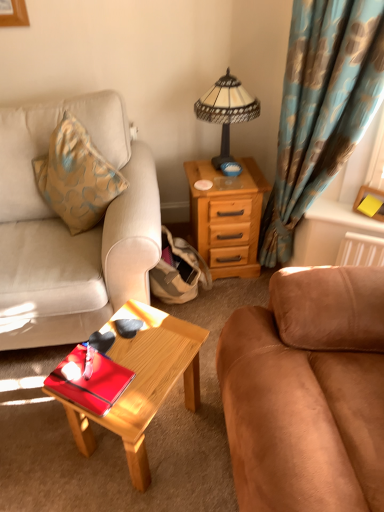
Question: Considering the relative sizes of suede brown couch at right, the 1th studio couch when ordered from right to left, and glossy red tray at center in the image provided, is suede brown couch at right, the 1th studio couch when ordered from right to left, smaller than glossy red tray at center?

Choices:
 (A) no
 (B) yes

Answer: (A)

Question: Are suede brown couch at right, the 1th studio couch when ordered from right to left, and glossy red tray at center beside each other?

Choices:
 (A) no
 (B) yes

Answer: (A)

Question: Does suede brown couch at right, the 1th studio couch when ordered from right to left, have a greater width compared to glossy red tray at center?

Choices:
 (A) yes
 (B) no

Answer: (A)

Question: Can you confirm if suede brown couch at right, which is the 2th studio couch from left to right, is bigger than glossy red tray at center?

Choices:
 (A) yes
 (B) no

Answer: (A)

Question: Does suede brown couch at right, which is the 2th studio couch from left to right, contain glossy red tray at center?

Choices:
 (A) no
 (B) yes

Answer: (A)

Question: Considering the positions of point (109, 391) and point (91, 98), is point (109, 391) closer or farther from the camera than point (91, 98)?

Choices:
 (A) farther
 (B) closer

Answer: (B)

Question: Considering the positions of glossy red tray at center and suede beige couch at left, the 1th studio couch viewed from the left, in the image, is glossy red tray at center bigger or smaller than suede beige couch at left, the 1th studio couch viewed from the left,?

Choices:
 (A) big
 (B) small

Answer: (B)

Question: In the image, is glossy red tray at center positioned in front of or behind suede beige couch at left, the 1th studio couch viewed from the left?

Choices:
 (A) behind
 (B) front

Answer: (B)

Question: Is glossy red tray at center inside the boundaries of suede beige couch at left, the 1th studio couch viewed from the left, or outside?

Choices:
 (A) outside
 (B) inside

Answer: (A)

Question: From the image's perspective, is glossy red tray at center above or below yellow matte picture frame at upper right?

Choices:
 (A) above
 (B) below

Answer: (B)

Question: Considering the relative positions of glossy red tray at center and yellow matte picture frame at upper right in the image provided, is glossy red tray at center to the left or to the right of yellow matte picture frame at upper right?

Choices:
 (A) left
 (B) right

Answer: (A)

Question: From a real-world perspective, relative to yellow matte picture frame at upper right, is glossy red tray at center vertically above or below?

Choices:
 (A) above
 (B) below

Answer: (B)

Question: Which is correct: glossy red tray at center is inside yellow matte picture frame at upper right, or outside of it?

Choices:
 (A) inside
 (B) outside

Answer: (B)

Question: Is blue floral fabric curtain at right spatially inside suede beige couch at left, the 2th studio couch viewed from the right, or outside of it?

Choices:
 (A) outside
 (B) inside

Answer: (A)

Question: Considering the relative positions of blue floral fabric curtain at right and suede beige couch at left, the 1th studio couch viewed from the left, in the image provided, is blue floral fabric curtain at right to the left or to the right of suede beige couch at left, the 1th studio couch viewed from the left,?

Choices:
 (A) left
 (B) right

Answer: (B)